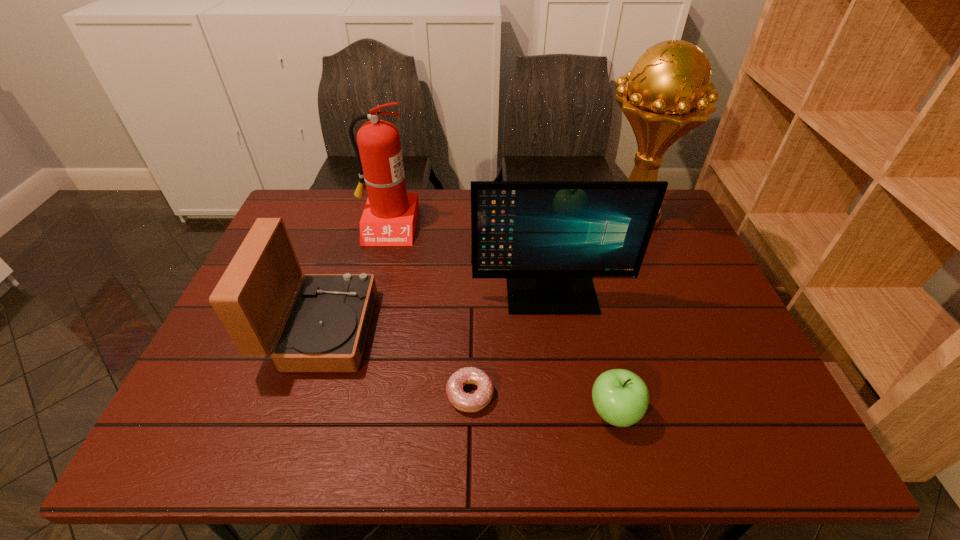
You are a GUI agent. You are given a task and a screenshot of the screen. Output one action in this format:
    pyautogui.click(x=<x>, y=<y>)
    Task: Click on the object at the far right corner
    The image size is (960, 540).
    Given the screenshot: What is the action you would take?
    pyautogui.click(x=665, y=98)

At what (x,y) coordinates should I click in order to perform the action: click on free space at the far edge. Please return your answer as a coordinate pair (x, y). The width and height of the screenshot is (960, 540). Looking at the image, I should click on (463, 221).

Locate an element on the screen. The height and width of the screenshot is (540, 960). vacant space at the near edge of the desktop is located at coordinates (573, 442).

This screenshot has width=960, height=540. I want to click on vacant area at the left edge, so click(x=180, y=413).

This screenshot has height=540, width=960. Find the location of `blank space at the right edge of the desktop`. blank space at the right edge of the desktop is located at coordinates (704, 348).

This screenshot has height=540, width=960. In the image, there is a desktop. In order to click on vacant space at the far left corner in this screenshot , I will do `click(320, 208)`.

This screenshot has width=960, height=540. In order to click on free space at the far right corner of the desktop in this screenshot , I will do `click(671, 227)`.

Identify the location of vacant area that lies between the fourth tallest object and the monitor. This screenshot has width=960, height=540. (437, 312).

I want to click on empty space between the fourth tallest object and the monitor, so click(437, 312).

Where is `vacant region between the trophy_cup and the second shortest object`? vacant region between the trophy_cup and the second shortest object is located at coordinates (622, 314).